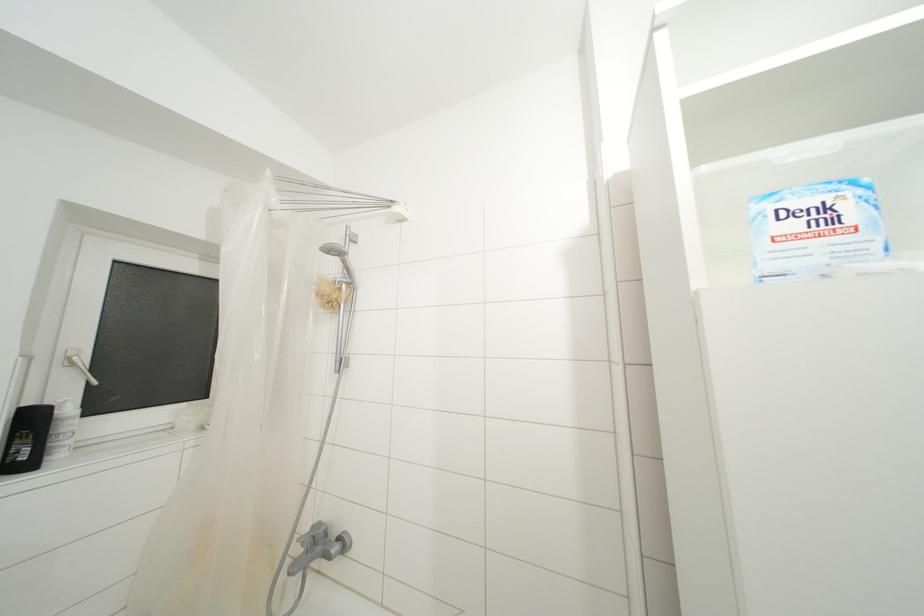
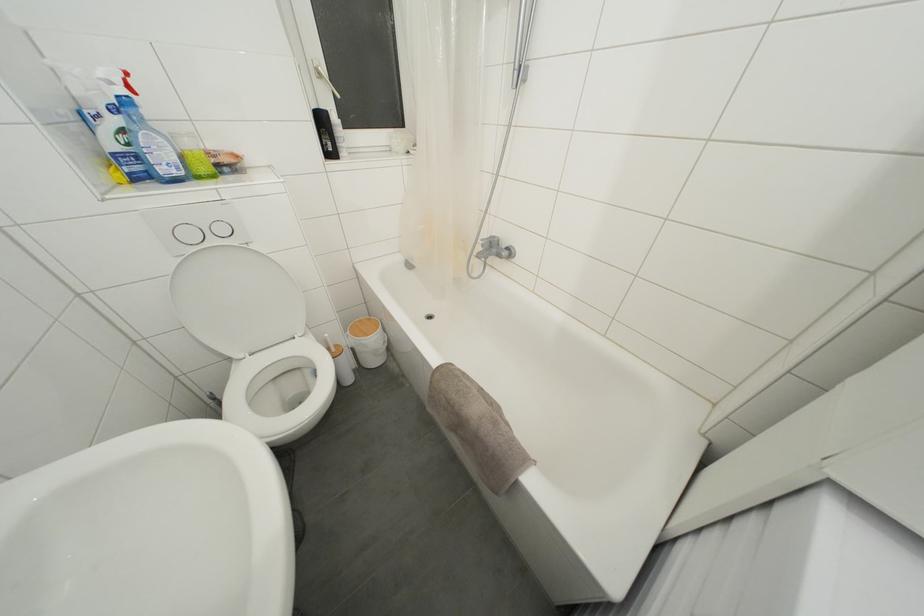
In the second image, find the point that corresponds to the point at 76,368 in the first image.

(323, 79)